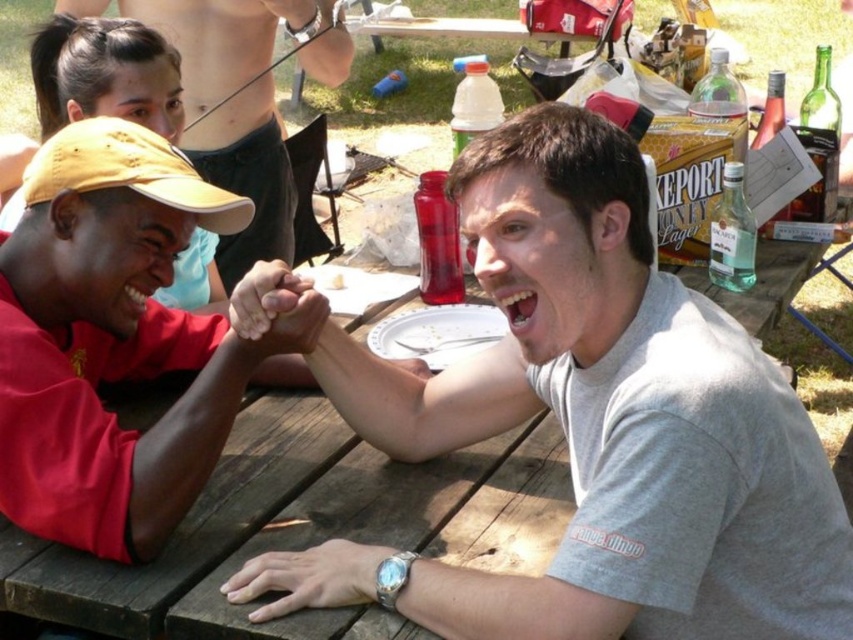
Question: Is matte yellow baseball cap at upper left wider than black matte hand at center?

Choices:
 (A) no
 (B) yes

Answer: (B)

Question: Which object is the farthest from the matte yellow baseball cap at upper left?

Choices:
 (A) gray matte t-shirt at center
 (B) smooth skin torso at upper center
 (C) black matte hand at center

Answer: (B)

Question: Among these points, which one is nearest to the camera?

Choices:
 (A) (287, 298)
 (B) (318, 596)
 (C) (608, 173)
 (D) (225, 24)

Answer: (C)

Question: Is matte yellow baseball cap at upper left closer to camera compared to silver metallic watch at lower center?

Choices:
 (A) yes
 (B) no

Answer: (B)

Question: Among these points, which one is nearest to the camera?

Choices:
 (A) (305, 564)
 (B) (515, 176)
 (C) (270, 60)

Answer: (B)

Question: Is matte red shirt at left bigger than smooth skin torso at upper center?

Choices:
 (A) no
 (B) yes

Answer: (A)